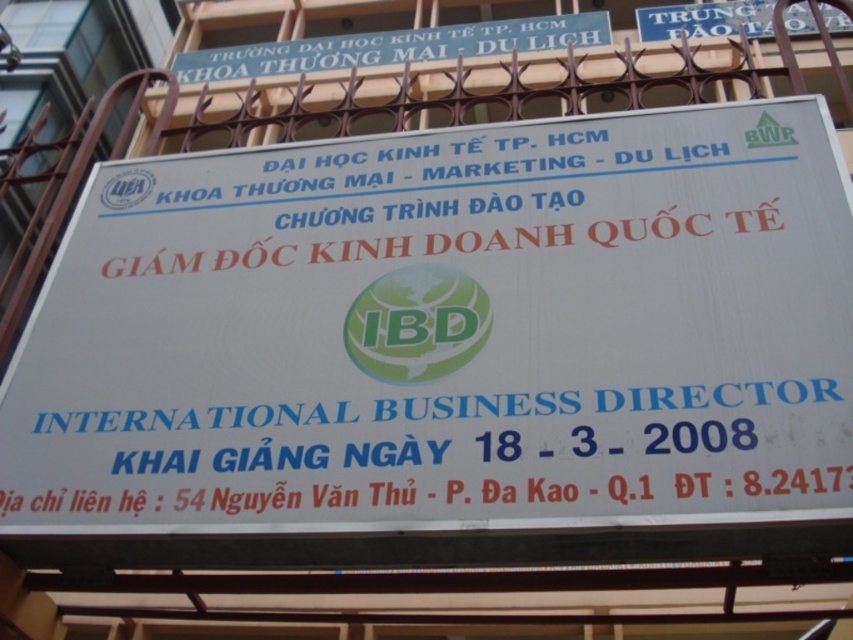
Consider the image. Which of these two, white paper sign at center or blue plastic signboard at upper center, stands shorter?

blue plastic signboard at upper center is shorter.

Image resolution: width=853 pixels, height=640 pixels. In order to click on white paper sign at center in this screenshot , I will do `click(447, 333)`.

The height and width of the screenshot is (640, 853). In order to click on white paper sign at center in this screenshot , I will do `click(447, 333)`.

Find the location of a particular element. white paper sign at center is located at coordinates (447, 333).